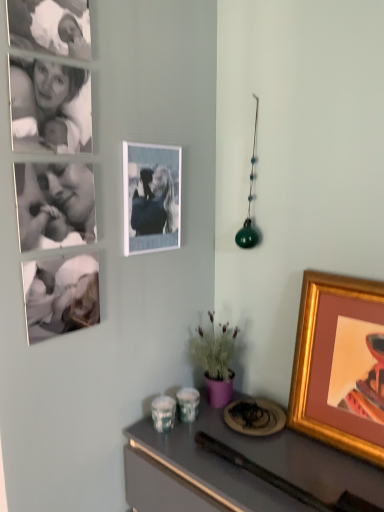
Question: Can you confirm if metallic gray desk at lower right is smaller than matte white photo frame at upper center, which is the 2th picture frame in right-to-left order?

Choices:
 (A) no
 (B) yes

Answer: (A)

Question: Can you confirm if metallic gray desk at lower right is shorter than matte white photo frame at upper center, the second picture frame positioned from the bottom?

Choices:
 (A) yes
 (B) no

Answer: (B)

Question: Is metallic gray desk at lower right beside matte white photo frame at upper center, which is the 2th picture frame in right-to-left order?

Choices:
 (A) yes
 (B) no

Answer: (B)

Question: Is metallic gray desk at lower right further to the viewer compared to matte white photo frame at upper center, which is the 2th picture frame in right-to-left order?

Choices:
 (A) no
 (B) yes

Answer: (A)

Question: Is metallic gray desk at lower right aimed at matte white photo frame at upper center, the second picture frame positioned from the bottom?

Choices:
 (A) yes
 (B) no

Answer: (B)

Question: Is metallic gray desk at lower right positioned in front of matte white photo frame at upper center, which appears as the 1th picture frame when viewed from the left?

Choices:
 (A) yes
 (B) no

Answer: (A)

Question: Is black and white photograph of a person at upper left touching gold-framed picture at right, acting as the 1th picture frame starting from the bottom?

Choices:
 (A) no
 (B) yes

Answer: (A)

Question: Can you confirm if black and white photograph of a person at upper left is positioned to the left of gold-framed picture at right, acting as the 1th picture frame starting from the bottom?

Choices:
 (A) no
 (B) yes

Answer: (B)

Question: From a real-world perspective, is black and white photograph of a person at upper left physically above gold-framed picture at right, which ranks as the second picture frame in top-to-bottom order?

Choices:
 (A) no
 (B) yes

Answer: (B)

Question: From a real-world perspective, is black and white photograph of a person at upper left physically below gold-framed picture at right, acting as the 1th picture frame starting from the bottom?

Choices:
 (A) yes
 (B) no

Answer: (B)

Question: Is black and white photograph of a person at upper left looking in the opposite direction of gold-framed picture at right, the second picture frame positioned from the left?

Choices:
 (A) no
 (B) yes

Answer: (A)

Question: Considering the relative sizes of black and white photograph of a person at upper left and gold-framed picture at right, acting as the 1th picture frame starting from the bottom, in the image provided, is black and white photograph of a person at upper left taller than gold-framed picture at right, acting as the 1th picture frame starting from the bottom,?

Choices:
 (A) yes
 (B) no

Answer: (B)

Question: Is black and white photograph of a person at upper left to the left of metallic gray desk at lower right from the viewer's perspective?

Choices:
 (A) yes
 (B) no

Answer: (A)